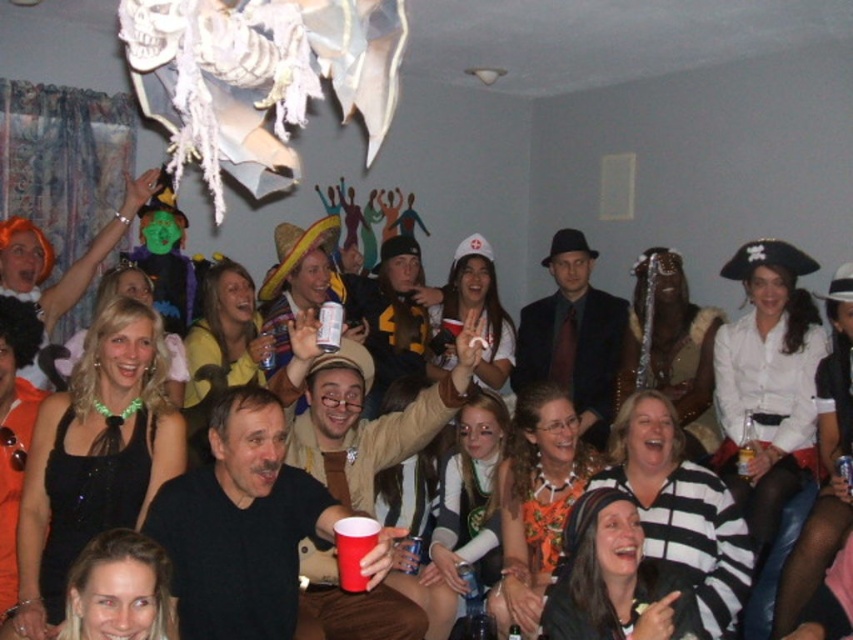
You are at the point labeled as point (415, 552) and want to reach the exit door located at point labeled point (140, 440). Can you walk directly towards it without any obstacles blocking your path?

Yes, you can walk directly towards the exit door located at point (140, 440) because point (140, 440) is in front of point (415, 552), meaning there are no obstacles blocking the path between them.

You are a photographer at the event and want to take a picture of the black sequined dress at lower left. Your camera is 8.80 feet away from the dress. Is the camera close enough to capture the dress clearly?

The camera is 8.80 feet away from the black sequined dress at lower left, so yes, the camera is close enough to capture the dress clearly.

You are standing in the room and want to move from the point closer to you to the point farther away. Which path should you take? The points are point (88, 476) and point (334, 534).

You should move from point (88, 476) to point (334, 534) because point (88, 476) is closer to you than point (334, 534).